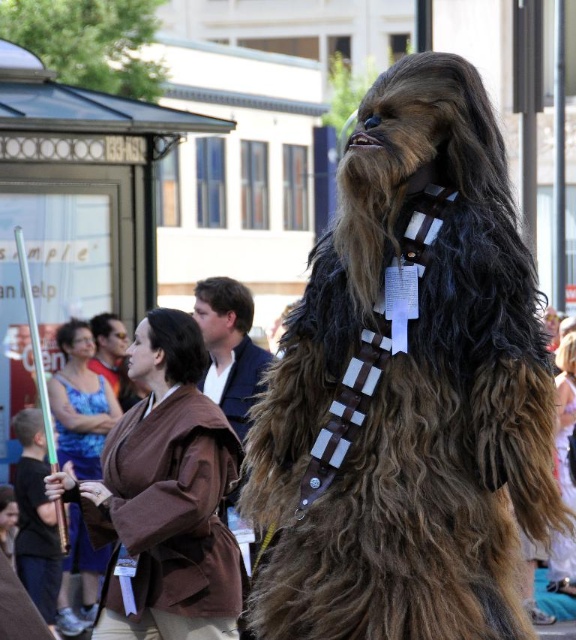
Can you confirm if brown fabric robe at center is smaller than brown fabric dress at center?

Indeed, brown fabric robe at center has a smaller size compared to brown fabric dress at center.

Between point (59, 493) and point (566, 584), which one is positioned behind?

Point (566, 584)

Who is more distant from viewer, (126, 474) or (570, 376)?

Point (570, 376)

Identify the location of brown fabric robe at center. (165, 496).

Does brown fuzzy fur at center have a greater height compared to blue satin dress at center?

Indeed, brown fuzzy fur at center has a greater height compared to blue satin dress at center.

Find the location of a particular element. brown fuzzy fur at center is located at coordinates (408, 388).

Based on the photo, does blue satin dress at center have a lesser width compared to brown fabric dress at center?

Yes, blue satin dress at center is thinner than brown fabric dress at center.

Is blue satin dress at center above brown fabric dress at center?

No.

Identify the location of blue satin dress at center. This screenshot has height=640, width=576. (79, 449).

This screenshot has height=640, width=576. What are the coordinates of `blue satin dress at center` in the screenshot? It's located at (79, 449).